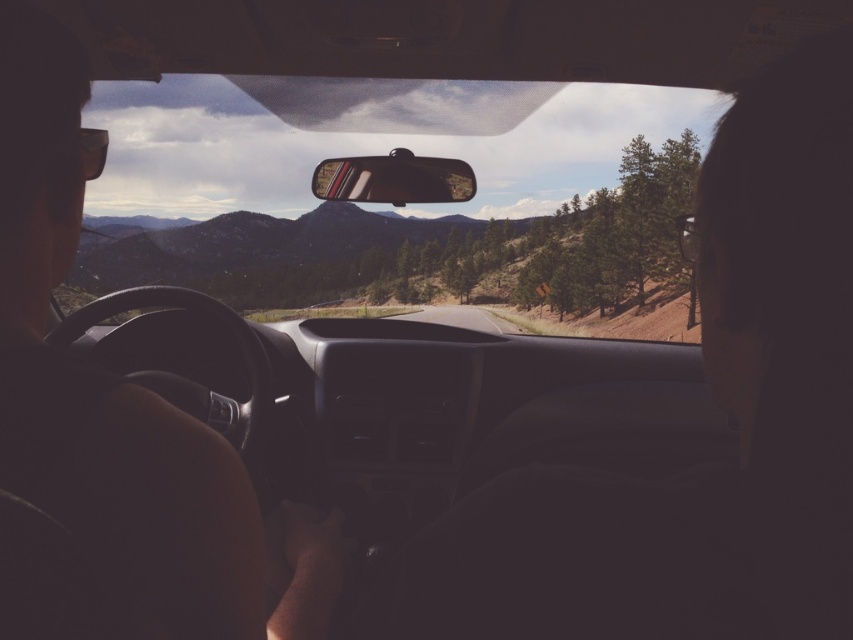
You are a passenger in a car and want to check the rearview mirror to see if there is a car behind you. Which object should you look at, the matte black steering wheel at left or the matte plastic view mirror at center?

You should look at the matte plastic view mirror at center because the matte black steering wheel at left is to the left of it, and the view mirror is typically positioned for the driver to check behind the vehicle.

Based on the photo, you are a passenger in a car and want to check the road ahead. Which object, the transparent glass windshield at center or the matte black steering wheel at left, offers a clearer view of the road ahead?

The transparent glass windshield at center offers a clearer view of the road ahead because it is made of transparent glass, unlike the matte black steering wheel at left which blocks the view.